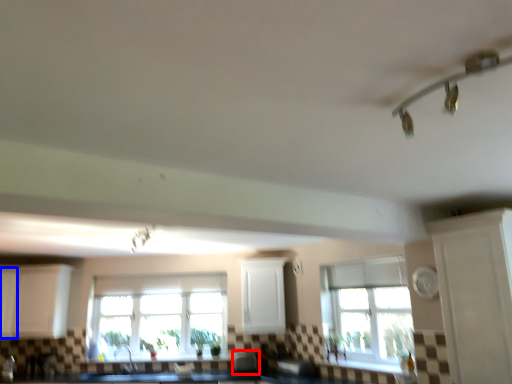
Question: Which of the following is the farthest to the observer, appliance (highlighted by a red box) or cabinetry (highlighted by a blue box)?

Choices:
 (A) appliance
 (B) cabinetry

Answer: (B)